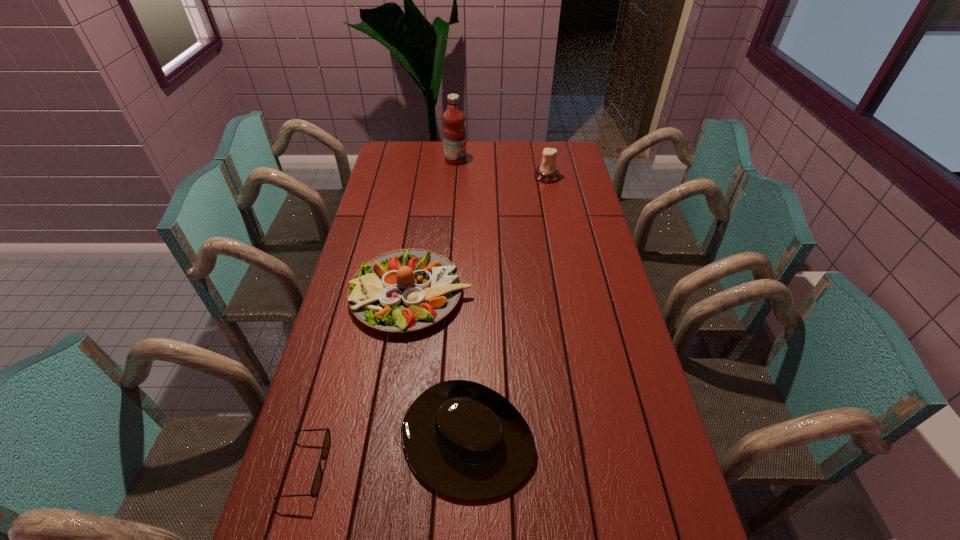
At what (x,y) coordinates should I click in order to perform the action: click on the farthest object. Please return your answer as a coordinate pair (x, y). Looking at the image, I should click on click(454, 132).

Locate an element on the screen. This screenshot has width=960, height=540. the tallest object is located at coordinates (454, 132).

This screenshot has height=540, width=960. Find the location of `candle holder`. candle holder is located at coordinates (547, 172).

I want to click on the second farthest object, so click(x=547, y=172).

The image size is (960, 540). In order to click on the third tallest object in this screenshot , I will do `click(407, 290)`.

Locate an element on the screen. This screenshot has height=540, width=960. the third nearest object is located at coordinates (407, 290).

I want to click on cowboy hat, so click(x=464, y=440).

Identify the location of sunglasses. (316, 484).

Image resolution: width=960 pixels, height=540 pixels. What are the coordinates of `free region located 0.170m on the front label of the farthest object` in the screenshot? It's located at (505, 160).

What are the coordinates of `free spot located 0.090m on the front of the fourth nearest object` in the screenshot? It's located at click(x=551, y=196).